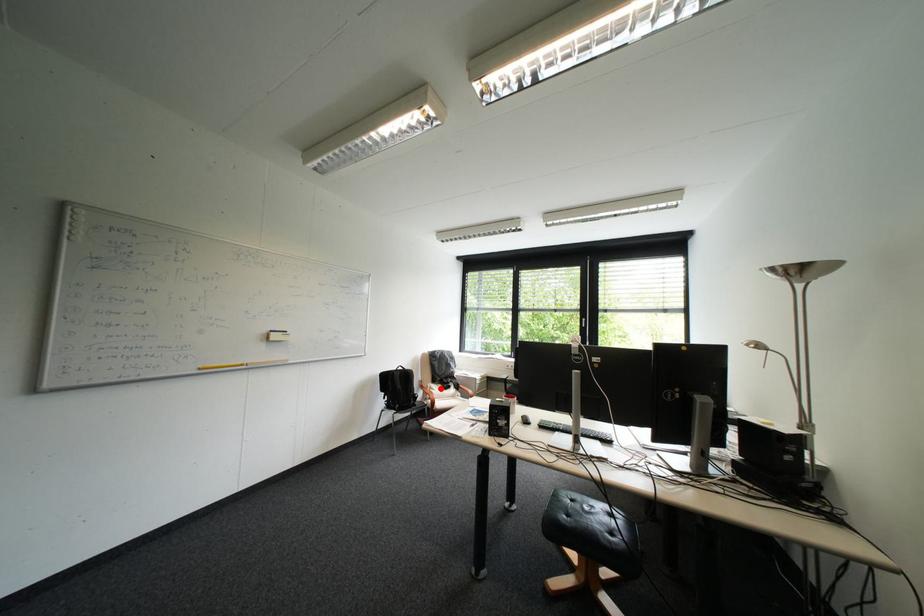
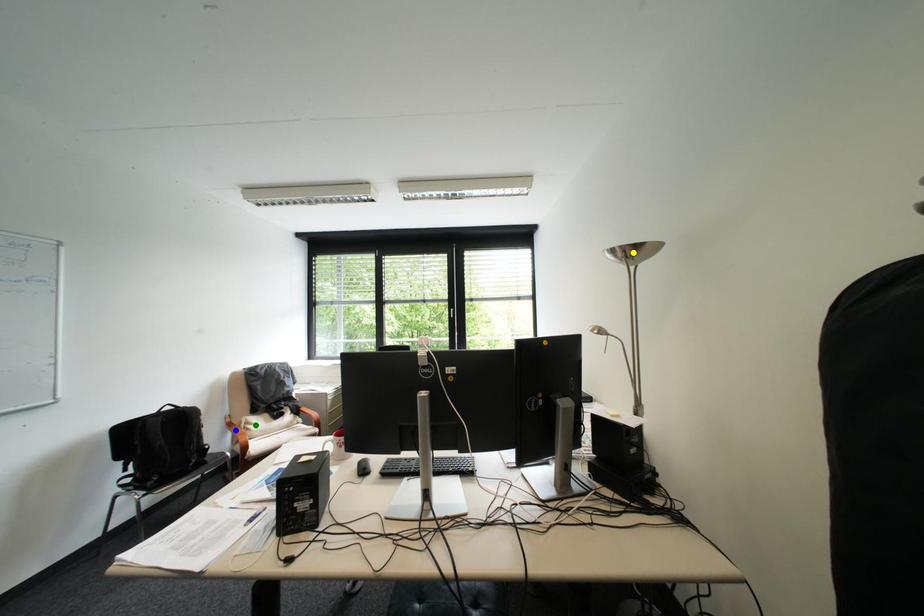
Question: I am providing you with two images of the same scene from different viewpoints. A red point is marked on the first image. You are given multiple points on the second image. Which spot in image 2 lines up with the point in image 1?

Choices:
 (A) green point
 (B) blue point
 (C) yellow point

Answer: (A)